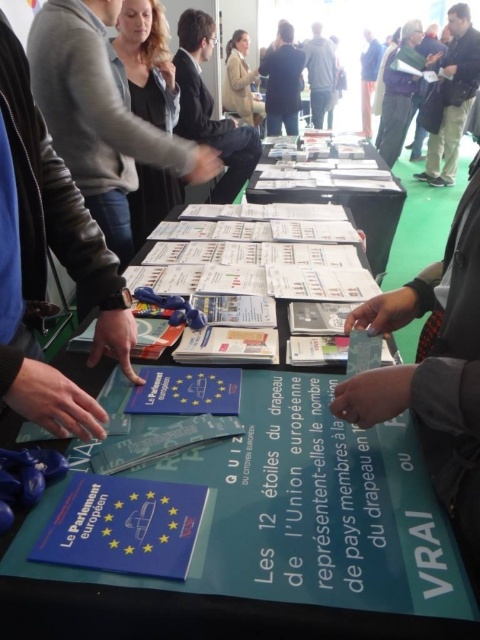
Who is shorter, dark suit at center or light brown leather jacket at upper center?

Standing shorter between the two is dark suit at center.

Is dark suit at center behind light brown leather jacket at upper center?

No, it is in front of light brown leather jacket at upper center.

Describe the element at coordinates (210, 108) in the screenshot. This screenshot has width=480, height=640. I see `dark suit at center` at that location.

This screenshot has height=640, width=480. Identify the location of dark suit at center. (210, 108).

Is dark suit at center wider than dark blue jeans at right?

Yes, dark suit at center is wider than dark blue jeans at right.

Is point (212, 113) in front of point (433, 177)?

Yes, it is in front of point (433, 177).

Between point (214, 124) and point (450, 49), which one is positioned behind?

The point (450, 49) is more distant.

What are the coordinates of `dark suit at center` in the screenshot? It's located at (210, 108).

Does gray wool sweater at upper right appear over light brown leather jacket at upper center?

No.

Who is taller, gray wool sweater at upper right or light brown leather jacket at upper center?

gray wool sweater at upper right is taller.

In order to click on gray wool sweater at upper right in this screenshot , I will do `click(397, 96)`.